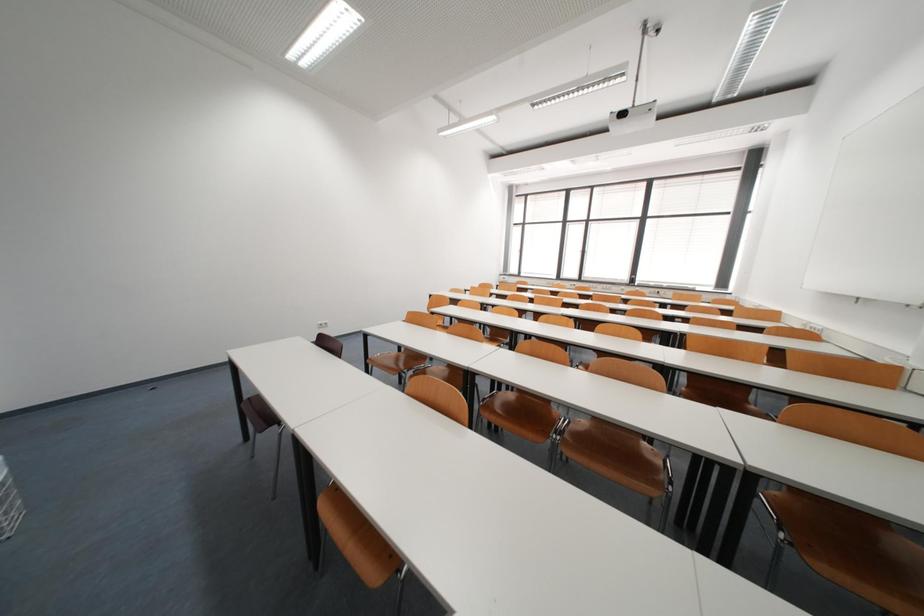
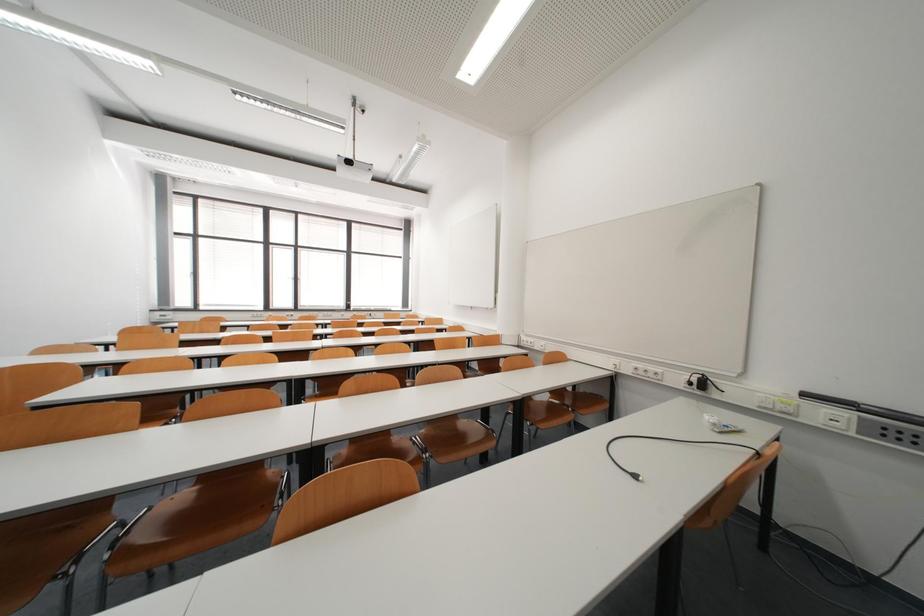
Question: The images are taken continuously from a first-person perspective. In which direction is your viewpoint rotating?

Choices:
 (A) Left
 (B) Right
 (C) Up
 (D) Down

Answer: (B)